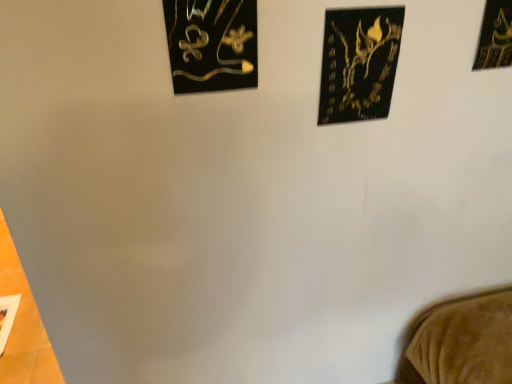
Question: Is black matte picture frame at upper center, the 2th picture frame from the left, shorter than metallic gold artwork at upper left, the third picture frame when ordered from right to left?

Choices:
 (A) yes
 (B) no

Answer: (B)

Question: Is black matte picture frame at upper center, marked as the 2th picture frame in a right-to-left arrangement, placed right next to metallic gold artwork at upper left, arranged as the 1th picture frame when viewed from the left?

Choices:
 (A) yes
 (B) no

Answer: (B)

Question: Does black matte picture frame at upper center, marked as the 2th picture frame in a right-to-left arrangement, have a smaller size compared to metallic gold artwork at upper left, arranged as the 1th picture frame when viewed from the left?

Choices:
 (A) no
 (B) yes

Answer: (B)

Question: From a real-world perspective, is black matte picture frame at upper center, the 2th picture frame from the left, positioned under metallic gold artwork at upper left, the third picture frame when ordered from right to left, based on gravity?

Choices:
 (A) no
 (B) yes

Answer: (B)

Question: From a real-world perspective, does black matte picture frame at upper center, marked as the 2th picture frame in a right-to-left arrangement, stand above metallic gold artwork at upper left, the third picture frame when ordered from right to left?

Choices:
 (A) yes
 (B) no

Answer: (B)

Question: Is black matte picture frame at upper center, marked as the 2th picture frame in a right-to-left arrangement, facing away from metallic gold artwork at upper left, arranged as the 1th picture frame when viewed from the left?

Choices:
 (A) no
 (B) yes

Answer: (A)

Question: Would you say black matte picture frame at upper right, acting as the first picture frame starting from the right, is outside metallic gold artwork at upper left, arranged as the 1th picture frame when viewed from the left?

Choices:
 (A) no
 (B) yes

Answer: (B)

Question: Does black matte picture frame at upper right, acting as the 3th picture frame starting from the left, turn towards metallic gold artwork at upper left, arranged as the 1th picture frame when viewed from the left?

Choices:
 (A) yes
 (B) no

Answer: (B)

Question: Considering the relative sizes of black matte picture frame at upper right, acting as the first picture frame starting from the right, and metallic gold artwork at upper left, arranged as the 1th picture frame when viewed from the left, in the image provided, is black matte picture frame at upper right, acting as the first picture frame starting from the right, shorter than metallic gold artwork at upper left, arranged as the 1th picture frame when viewed from the left,?

Choices:
 (A) no
 (B) yes

Answer: (A)

Question: Is the depth of black matte picture frame at upper right, acting as the 3th picture frame starting from the left, less than that of metallic gold artwork at upper left, arranged as the 1th picture frame when viewed from the left?

Choices:
 (A) no
 (B) yes

Answer: (A)

Question: From the image's perspective, does black matte picture frame at upper right, acting as the first picture frame starting from the right, appear lower than metallic gold artwork at upper left, the third picture frame when ordered from right to left?

Choices:
 (A) no
 (B) yes

Answer: (A)

Question: Does black matte picture frame at upper right, acting as the 3th picture frame starting from the left, have a greater height compared to metallic gold artwork at upper left, arranged as the 1th picture frame when viewed from the left?

Choices:
 (A) no
 (B) yes

Answer: (B)

Question: Is black matte picture frame at upper center, the 2th picture frame from the left, not inside black matte picture frame at upper right, acting as the first picture frame starting from the right?

Choices:
 (A) no
 (B) yes

Answer: (B)